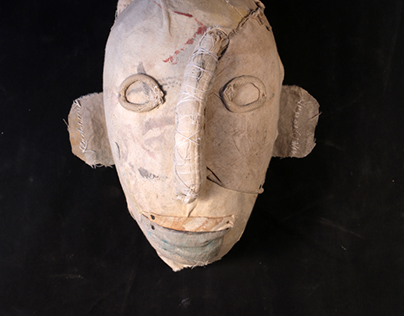
Where is `red paint`? The image size is (404, 316). red paint is located at coordinates click(203, 28).